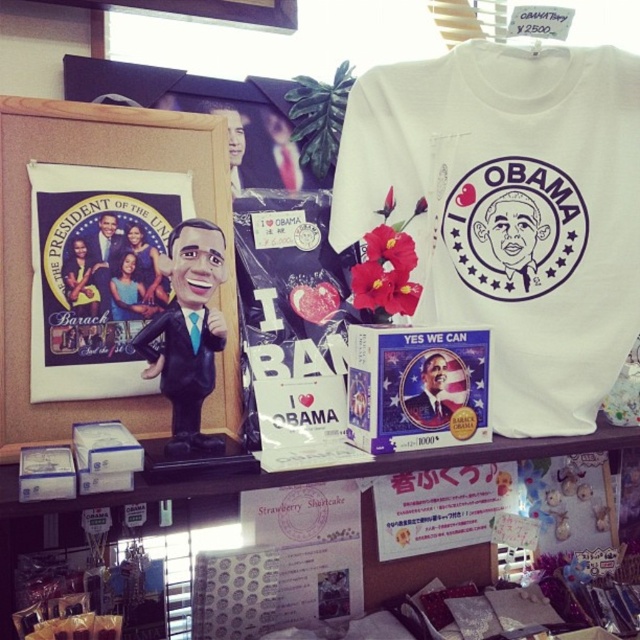
You are standing in front of the Obama merchandise shelf. You see two points marked on the shelf. Which point is closer to you, point [506,412] or point [260,481]?

Point [506,412] is further to the viewer than point [260,481], so point [506,412] is closer to you.

You are an interior designer arranging items on a shelf. You have a wooden frame at left and a white paper at upper center. The distance between them is 10.68 inches. If you need to place a decorative item that requires at least 12 inches of space between them, will the current arrangement work?

The wooden frame at left is 10.68 inches from the white paper at upper center. Since the required space is 12 inches, the current arrangement does not provide enough space. You need to adjust the placement to increase the distance between them.

Based on the scene description, where is the wooden frame at left located on the shelf?

The wooden frame at left is located at point (29, 252) on the shelf.